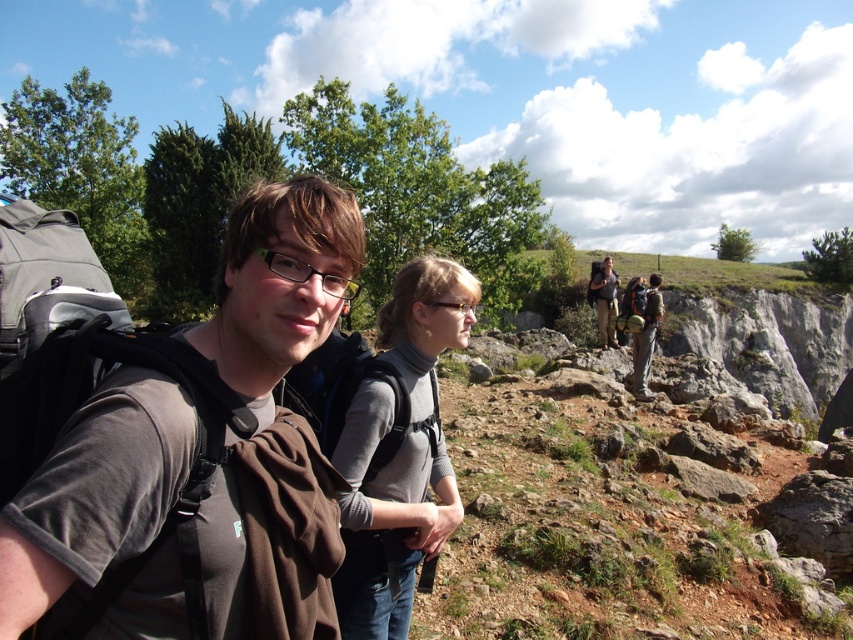
Question: Does dark gray fabric backpack at left have a smaller size compared to khaki cotton pants at center?

Choices:
 (A) yes
 (B) no

Answer: (A)

Question: Which object is positioned farthest from the khaki cotton pants at center?

Choices:
 (A) gray wool sweater at center
 (B) dark gray fabric backpack at left

Answer: (B)

Question: Is dark gray fabric backpack at left wider than gray wool sweater at center?

Choices:
 (A) yes
 (B) no

Answer: (A)

Question: Which of the following is the closest to the observer?

Choices:
 (A) (363, 248)
 (B) (602, 308)

Answer: (A)

Question: Does dark gray fabric backpack at left have a greater width compared to khaki cotton pants at center?

Choices:
 (A) no
 (B) yes

Answer: (A)

Question: Which object is the closest to the khaki cotton pants at center?

Choices:
 (A) gray wool sweater at center
 (B) dark gray fabric backpack at left

Answer: (A)